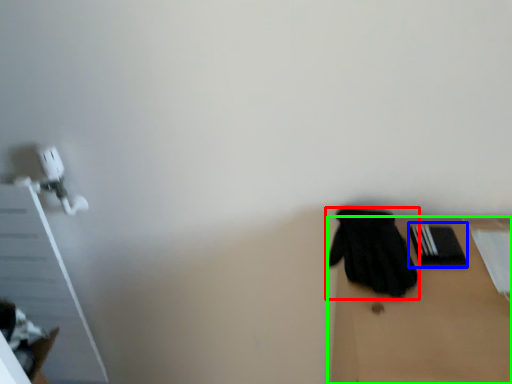
Question: Estimate the real-world distances between objects in this image. Which object is farther from glove (highlighted by a red box), bin (highlighted by a blue box) or table (highlighted by a green box)?

Choices:
 (A) bin
 (B) table

Answer: (A)